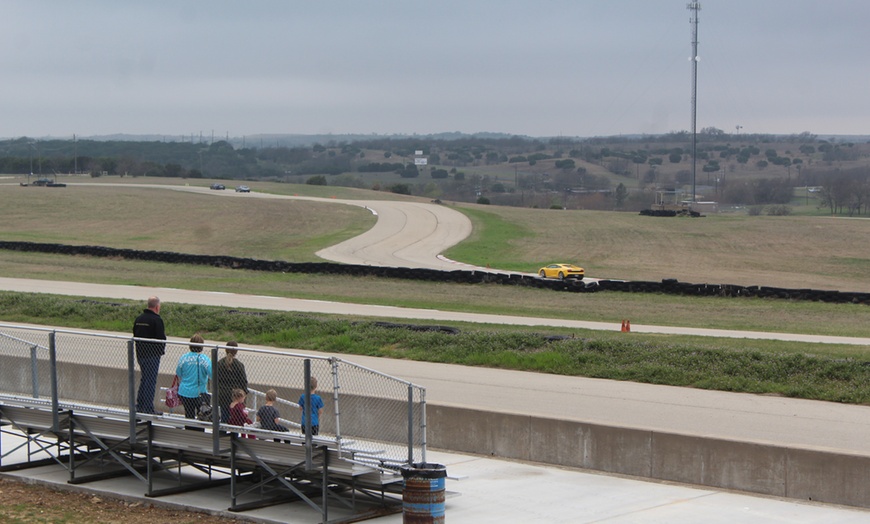
I want to click on 1 trash bag, so click(427, 468).